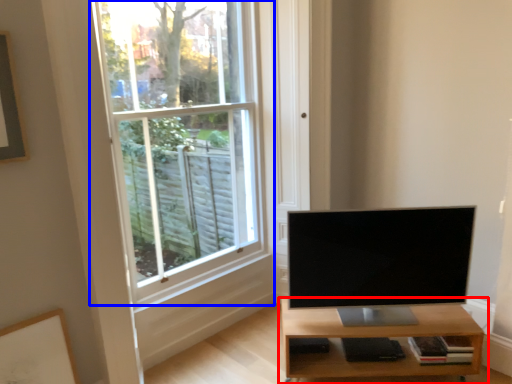
Question: Among these objects, which one is farthest to the camera, shelf (highlighted by a red box) or window (highlighted by a blue box)?

Choices:
 (A) shelf
 (B) window

Answer: (A)